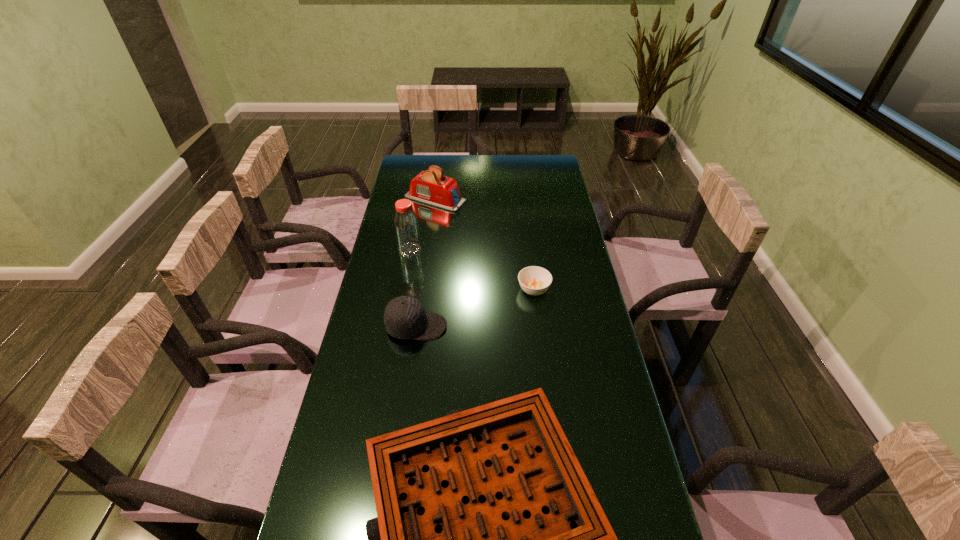
In order to click on unoccupied area between the baseball cap and the tallest object in this screenshot , I will do `click(413, 288)`.

Identify the location of empty space between the third farthest object and the bottle. [471, 270].

The width and height of the screenshot is (960, 540). I want to click on blank region between the third farthest object and the bottle, so click(x=471, y=270).

You are a GUI agent. You are given a task and a screenshot of the screen. Output one action in this format:
    pyautogui.click(x=<x>, y=<y>)
    Task: Click on the empty space between the tallest object and the baseball cap
    The width and height of the screenshot is (960, 540).
    Given the screenshot: What is the action you would take?
    pyautogui.click(x=413, y=288)

The image size is (960, 540). Identify the location of unoccupied position between the soup bowl and the baseball cap. (475, 308).

Identify the location of free space between the second nearest object and the third nearest object. The width and height of the screenshot is (960, 540). (475, 308).

Where is `object that is the second closest to the bottle`? object that is the second closest to the bottle is located at coordinates (405, 317).

Choose which object is the third nearest neighbor to the farthest object. Please provide its 2D coordinates. Your answer should be formatted as a tuple, i.e. [(x, y)], where the tuple contains the x and y coordinates of a point satisfying the conditions above.

[(405, 317)]

You are a GUI agent. You are given a task and a screenshot of the screen. Output one action in this format:
    pyautogui.click(x=<x>, y=<y>)
    Task: Click on the vacant space that satisfies the following two spatial constraints: 1. on the front side of the second farthest object; 2. on the right side of the third nearest object
    This screenshot has height=540, width=960.
    Given the screenshot: What is the action you would take?
    click(x=403, y=289)